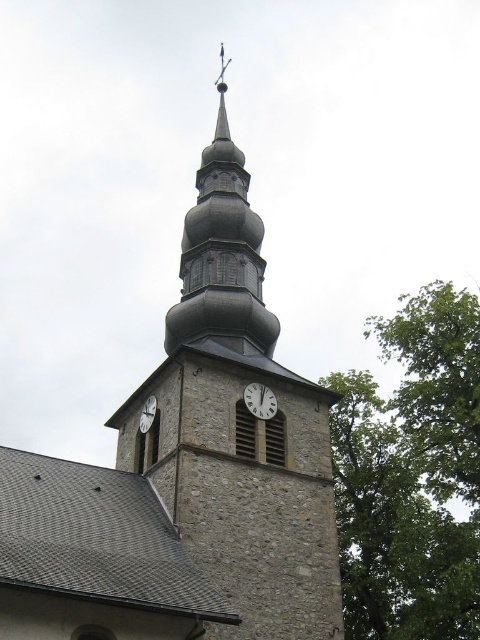
You are standing at the base of the stone clock tower at center and want to throw a small ball to reach the green leafy tree at upper right. The ball can travel up to 15 meters. Will it be possible to reach the tree with one throw?

The stone clock tower at center is 14.10 meters away from the green leafy tree at upper right. Since the ball can travel up to 15 meters, it is possible to reach the tree with one throw.

You are standing in front of the church tower and notice two points marked on the tower. The first point is at coordinates point (x=219, y=321) and the second is at point (x=396, y=346). Which point is closer to you?

Point (x=219, y=321) is in front of point (x=396, y=346), so it is closer to you.

You are an architect designing a new clock to place on the church tower. You have two options for the clock face material and finish. The first is a white matte clock at center, and the second is a white glossy clock at center. Based on the existing tower structure, which clock might require a wider space to accommodate its design?

The white matte clock at center might require a wider space because it is described as wider than the white glossy clock at center.